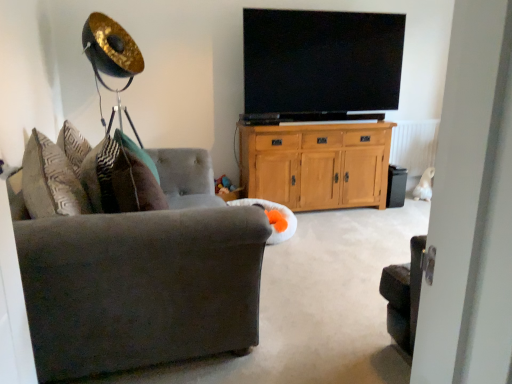
Question: Do you think black matte speaker at lower right is within flat-screen tv at upper center, or outside of it?

Choices:
 (A) inside
 (B) outside

Answer: (B)

Question: From the image's perspective, relative to flat-screen tv at upper center, is black matte speaker at lower right above or below?

Choices:
 (A) above
 (B) below

Answer: (B)

Question: Which is farther from the black matte speaker at lower right?

Choices:
 (A) green fabric pillow at left
 (B) white soft bean bag at center
 (C) flat-screen tv at upper center
 (D) velvet gray couch at left
 (E) light oak cabinet at center

Answer: (D)

Question: Which of these objects is positioned farthest from the flat-screen tv at upper center?

Choices:
 (A) green fabric pillow at left
 (B) velvet gray couch at left
 (C) light oak cabinet at center
 (D) black matte speaker at lower right
 (E) white soft bean bag at center

Answer: (B)